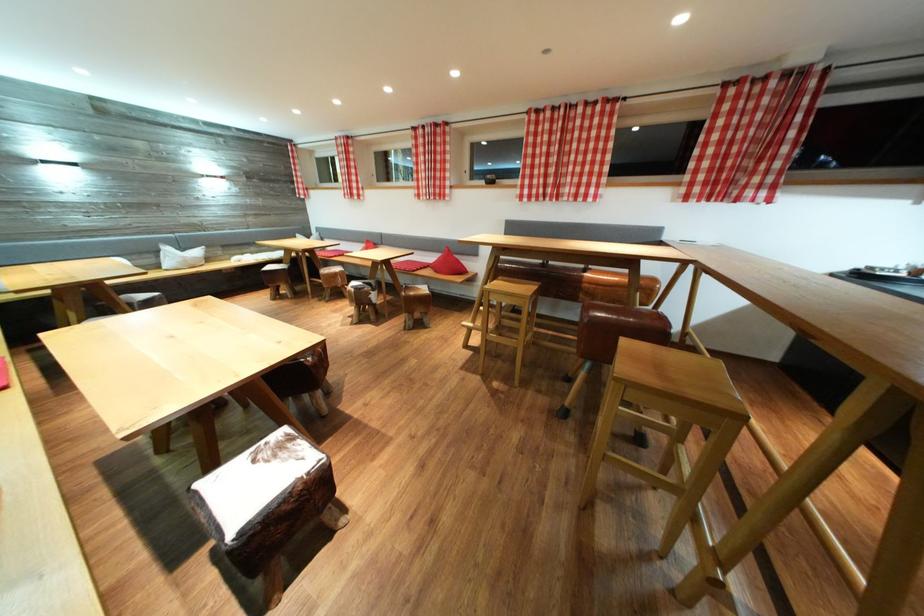
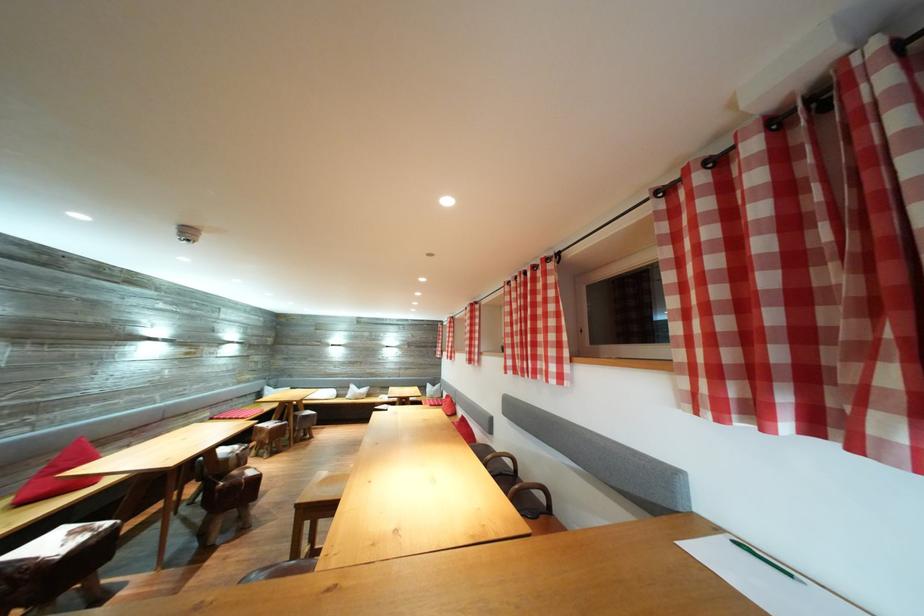
Where in the second image is the point corresponding to point 286,452 from the first image?

(91, 536)